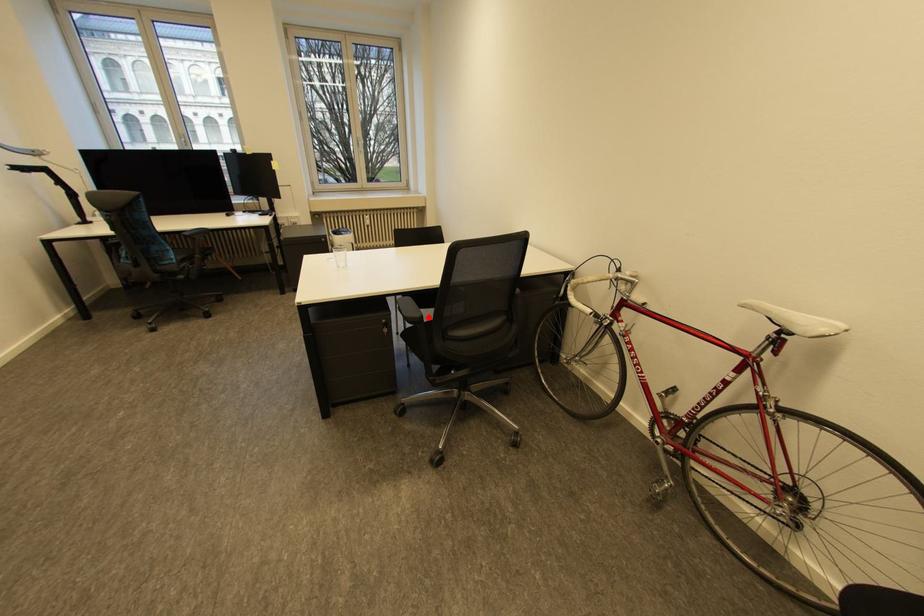
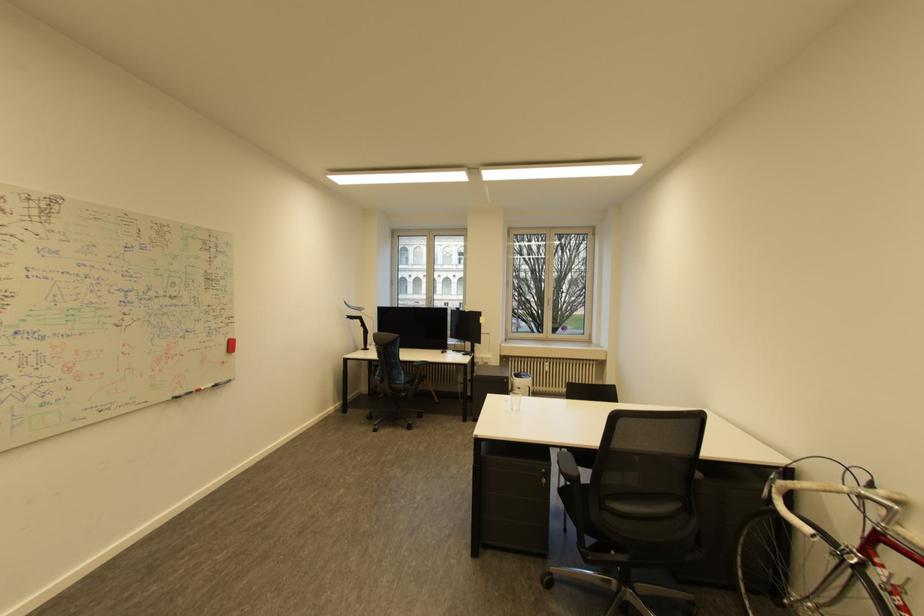
Where in the second image is the point corresponding to the highlighted location from the first image?

(586, 477)